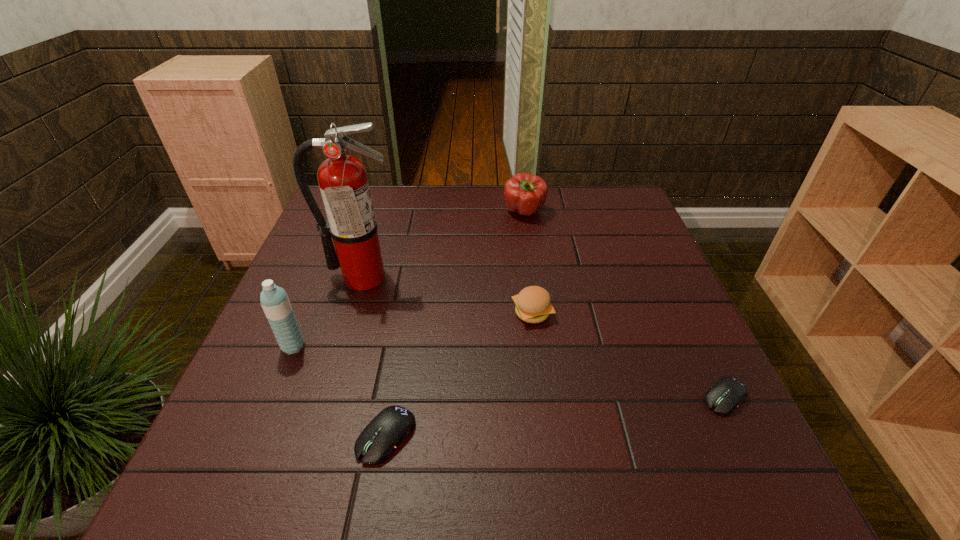
You are a GUI agent. You are given a task and a screenshot of the screen. Output one action in this format:
    pyautogui.click(x=<x>, y=<y>)
    Task: Click on the left computer equipment
    The width and height of the screenshot is (960, 540).
    Given the screenshot: What is the action you would take?
    pyautogui.click(x=376, y=443)

Find the location of a particular element. the taller computer equipment is located at coordinates (376, 443).

The height and width of the screenshot is (540, 960). Find the location of `the shorter computer equipment`. the shorter computer equipment is located at coordinates [x=725, y=396].

Locate an element on the screen. This screenshot has height=540, width=960. the right computer equipment is located at coordinates (725, 396).

The image size is (960, 540). Identify the location of bell pepper. (524, 193).

Identify the location of the fourth shortest object. (524, 193).

Find the location of a particular element. This screenshot has height=540, width=960. the fourth farthest object is located at coordinates (274, 300).

At what (x,y) coordinates should I click in order to perform the action: click on the second tallest object. Please return your answer as a coordinate pair (x, y). Looking at the image, I should click on (274, 300).

You are a GUI agent. You are given a task and a screenshot of the screen. Output one action in this format:
    pyautogui.click(x=<x>, y=<y>)
    Task: Click on the fourth nearest object
    This screenshot has width=960, height=540.
    Given the screenshot: What is the action you would take?
    pyautogui.click(x=533, y=304)

Identify the location of hamburger. [x=533, y=304].